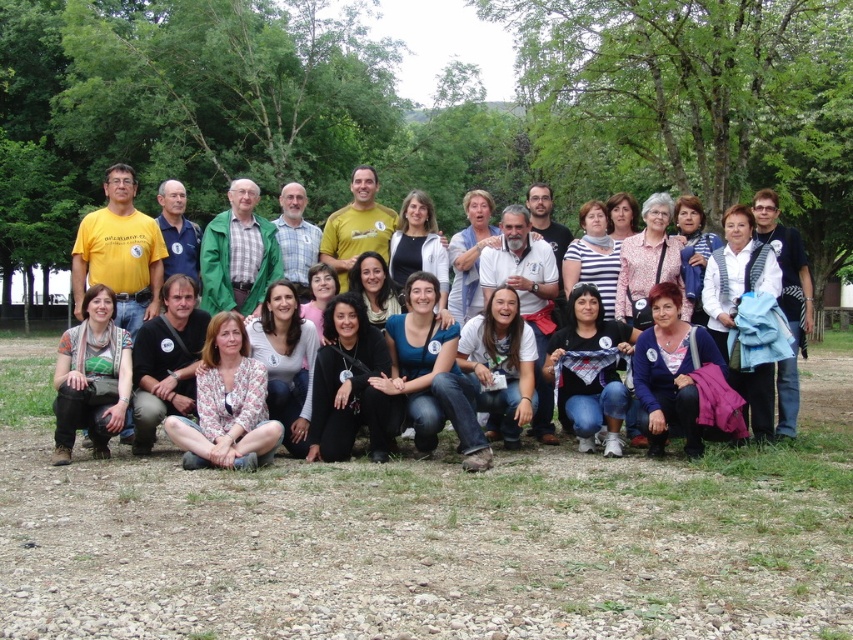
Question: Is blue sweater at lower right above light blue shirt at center?

Choices:
 (A) no
 (B) yes

Answer: (A)

Question: Based on their relative distances, which object is nearer to the blue sweater at lower right?

Choices:
 (A) black cotton shirt at lower left
 (B) green fabric jacket at center

Answer: (A)

Question: Which of these objects is positioned closest to the black cotton shirt at lower left?

Choices:
 (A) matte black scarf at lower left
 (B) green fabric jacket at center

Answer: (A)

Question: Which of these objects is positioned farthest from the blue sweater at lower right?

Choices:
 (A) matte black scarf at lower left
 (B) blue fabric bag at lower right
 (C) green fabric jacket at center
 (D) light blue shirt at center

Answer: (A)

Question: Does black cotton shirt at lower left appear on the right side of blue fabric bag at lower right?

Choices:
 (A) no
 (B) yes

Answer: (A)

Question: Does matte black shirt at center appear on the right side of blue sweater at lower right?

Choices:
 (A) yes
 (B) no

Answer: (B)